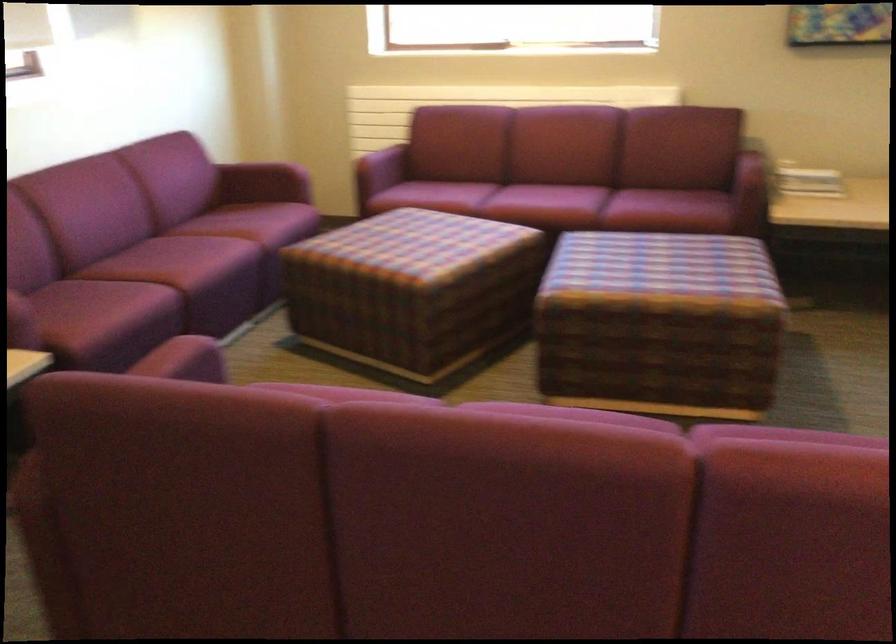
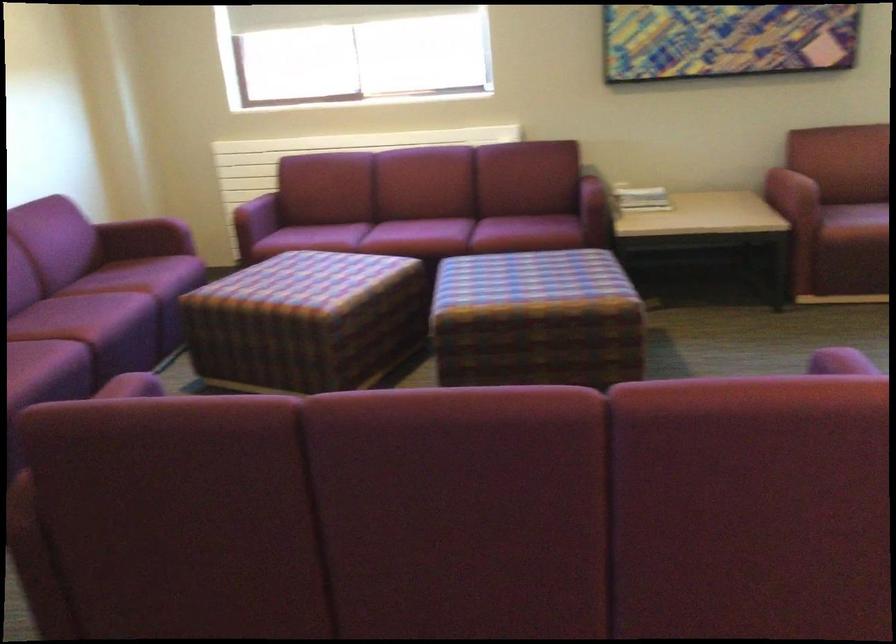
Find the pixel in the second image that matches point 403,290 in the first image.

(306, 321)